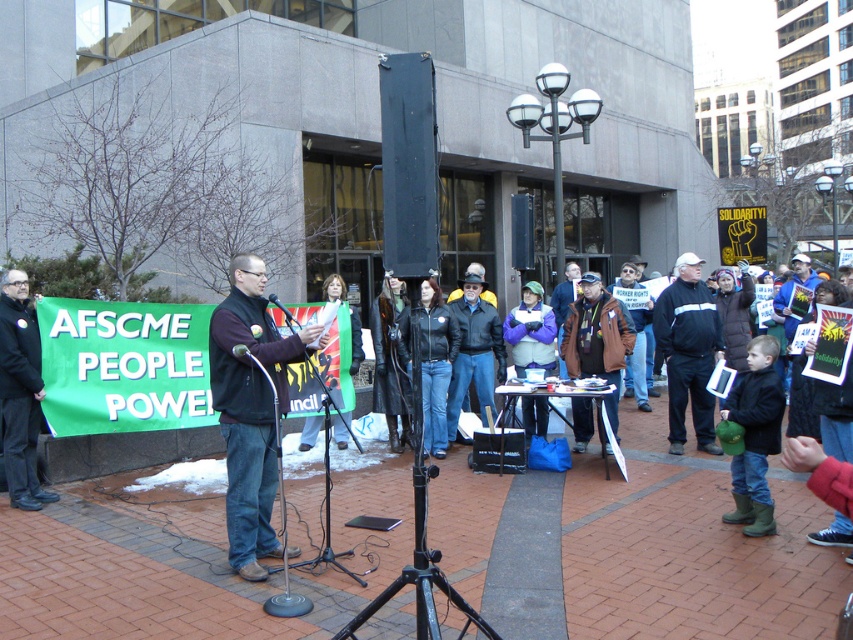
Question: Among these objects, which one is farthest from the camera?

Choices:
 (A) black jacket at center
 (B) dark blue jeans at center
 (C) black leather jacket at center

Answer: (C)

Question: Which is nearer to the dark blue jeans at center?

Choices:
 (A) black jacket at center
 (B) black leather jacket at center
 (C) matte black microphone at center

Answer: (C)

Question: Which object is closer to the camera taking this photo?

Choices:
 (A) black fabric jacket at left
 (B) dark blue jeans at center
 (C) matte black microphone at center
 (D) black leather jacket at center

Answer: (B)

Question: Can you confirm if black leather jacket at center is wider than purple fleece jacket at center?

Choices:
 (A) yes
 (B) no

Answer: (A)

Question: Can you confirm if black jacket at center is positioned below black fabric jacket at left?

Choices:
 (A) yes
 (B) no

Answer: (B)

Question: Is black jacket at center below matte black jacket at center?

Choices:
 (A) no
 (B) yes

Answer: (A)